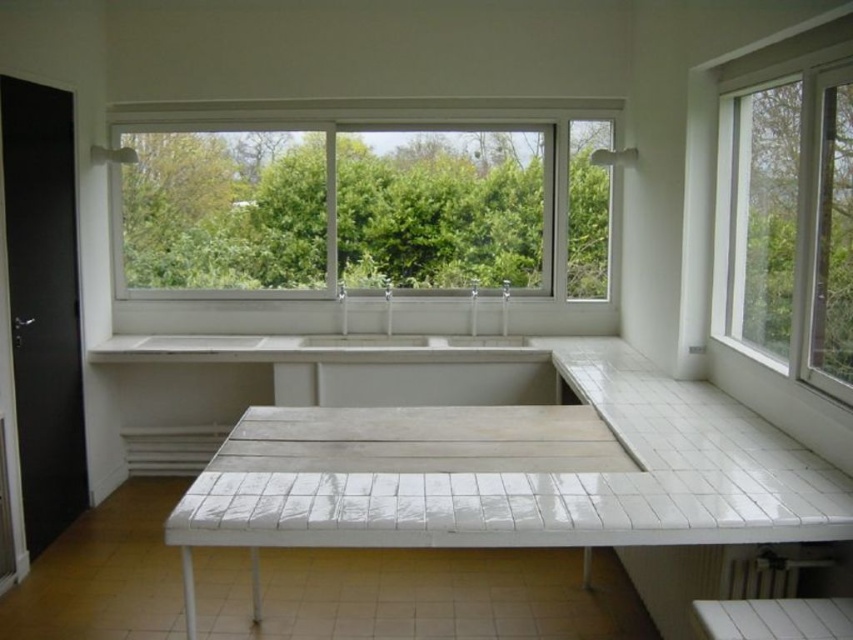
Question: Is clear glass window at center positioned in front of white ceramic sink at center?

Choices:
 (A) yes
 (B) no

Answer: (B)

Question: Which point is closer to the camera?

Choices:
 (A) white glass window at right
 (B) white tile table at center

Answer: (B)

Question: Which is farther from the white tile table at center?

Choices:
 (A) white glossy sink at center
 (B) clear glass window at center
 (C) white glass window at right
 (D) white ceramic sink at center

Answer: (B)

Question: Which object is the farthest from the white ceramic sink at center?

Choices:
 (A) clear glass window at center
 (B) white tile table at center
 (C) white glass window at right

Answer: (C)

Question: Where is clear glass window at center located in relation to white glossy sink at center in the image?

Choices:
 (A) above
 (B) below

Answer: (A)

Question: In this image, where is white tile table at center located relative to white ceramic sink at center?

Choices:
 (A) below
 (B) above

Answer: (A)